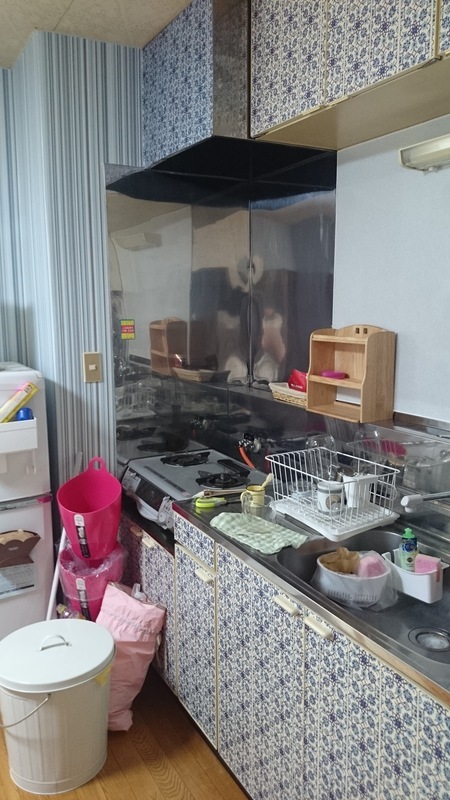
The width and height of the screenshot is (450, 800). In order to click on ceiling in front of cabinets in this screenshot , I will do `click(124, 18)`.